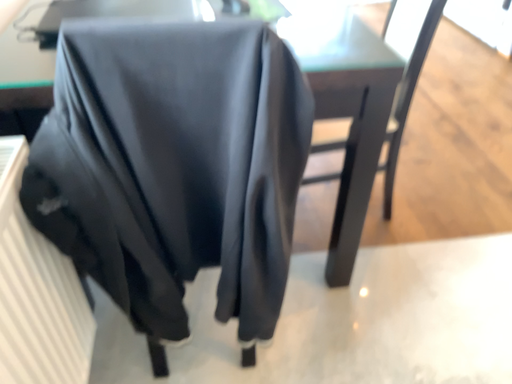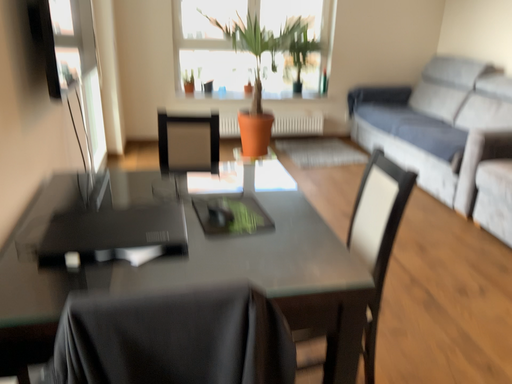
Question: Which way did the camera rotate in the video?

Choices:
 (A) rotated downward
 (B) rotated upward

Answer: (B)